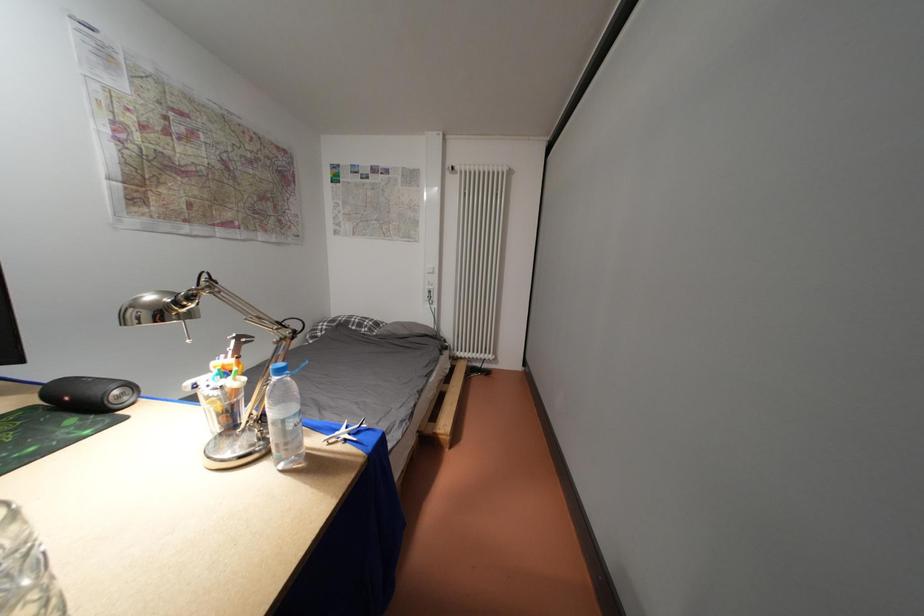
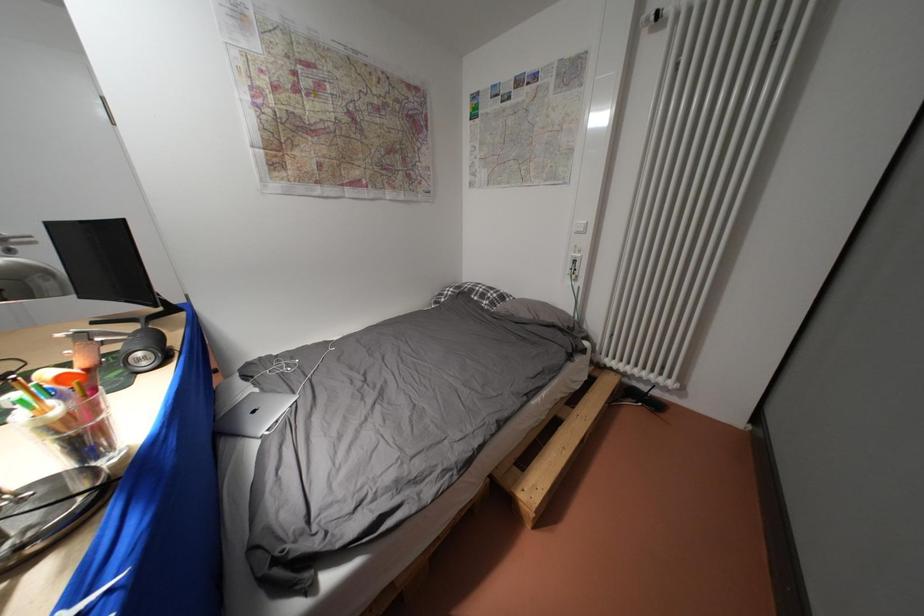
Question: The camera is either moving clockwise (left) or counter-clockwise (right) around the object. The first image is from the beginning of the video and the second image is from the end. Is the camera moving left or right when shooting the video?

Choices:
 (A) Left
 (B) Right

Answer: (B)